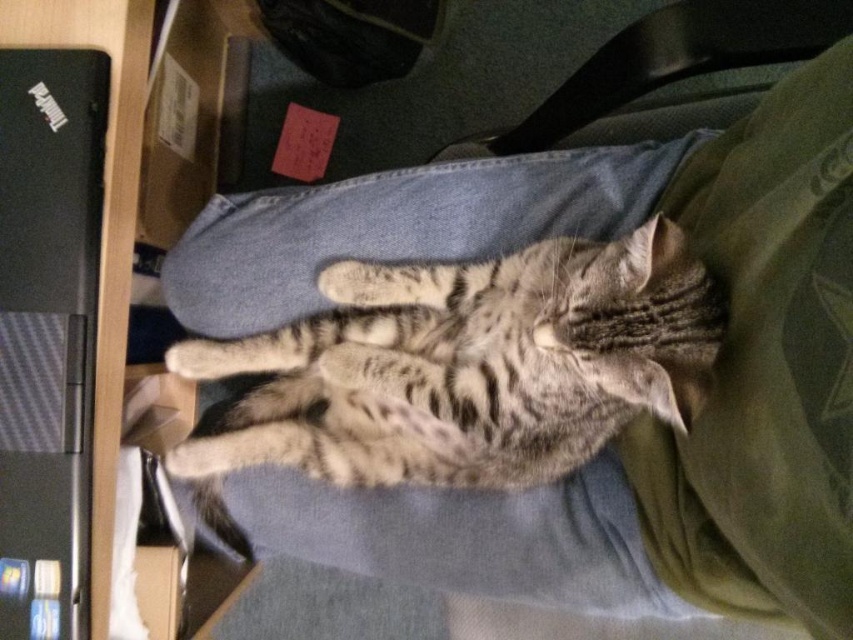
You are a delivery robot entering a room and need to deliver a package to the black carbon fiber laptop at left. The tabby fur cat at center is blocking the path. Can you navigate around the cat without moving it?

The tabby fur cat at center is larger than the black carbon fiber laptop at left, so the cat is taking up more space. To deliver the package to the black carbon fiber laptop at left, you can go around the cat on either side since the cat is at the center, but ensure there is enough space to maneuver around its larger body.

You are a delivery robot entering the room and need to avoid the tabby fur cat at center. The cat is represented by the point at coordinates (468, 365). What is the safest path to take around the cat?

The safest path would be to go around the tabby fur cat at center, ensuring you stay clear of its position marked by the point at coordinates (468, 365) to avoid disturbing it.

Based on the photo, you are a delivery robot entering a room and need to place a package on the black carbon fiber laptop at left without disturbing the tabby fur cat at center. Can you safely place the package there?

The tabby fur cat at center is positioned under the black carbon fiber laptop at left, so placing a package on the laptop might disturb the cat since the cat is directly underneath it. Choose another location to avoid disturbing the cat.